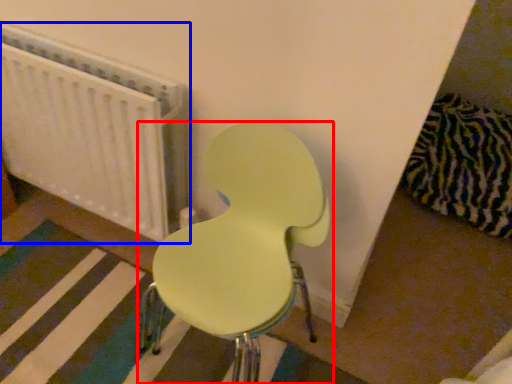
Question: Which object is closer to the camera taking this photo, chair (highlighted by a red box) or radiator (highlighted by a blue box)?

Choices:
 (A) chair
 (B) radiator

Answer: (A)